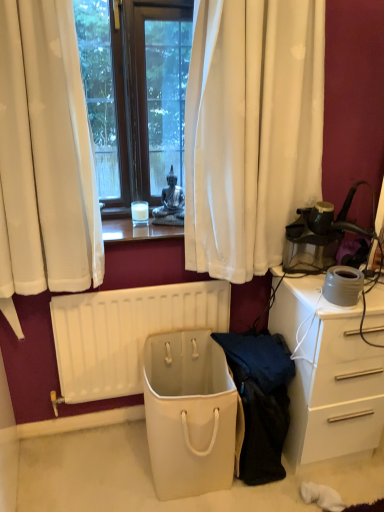
You are a GUI agent. You are given a task and a screenshot of the screen. Output one action in this format:
    pyautogui.click(x=<x>, y=<y>)
    Task: Click on the free point above white matte radiator at lower center (from a real-world perspective)
    The image size is (384, 512).
    Given the screenshot: What is the action you would take?
    pyautogui.click(x=139, y=286)